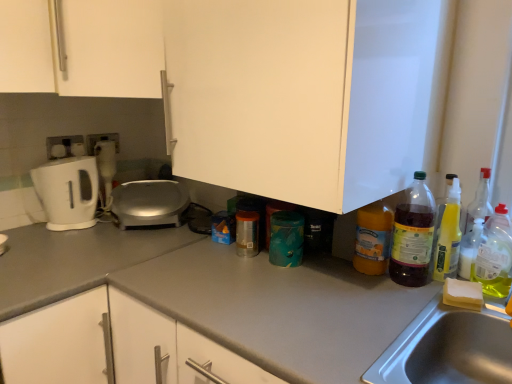
Locate an element on the screen. vacant area that is situated to the right of white glossy electric kettle at left is located at coordinates (95, 227).